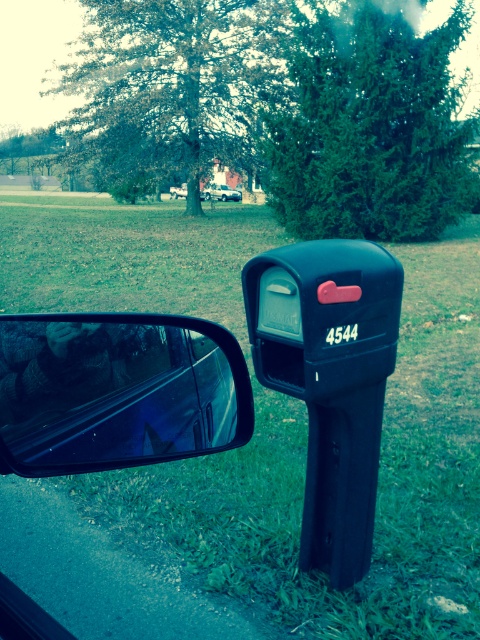
Question: Can you confirm if shiny black mirror at lower left is smaller than satin silver sedan at center?

Choices:
 (A) yes
 (B) no

Answer: (A)

Question: Which point is closer to the camera taking this photo?

Choices:
 (A) click(x=225, y=196)
 (B) click(x=273, y=269)
 (C) click(x=220, y=445)

Answer: (C)

Question: Which of the following is the farthest from the observer?

Choices:
 (A) (169, 356)
 (B) (178, 193)

Answer: (B)

Question: Can you confirm if green grass at lower center is wider than matte black mailbox at right?

Choices:
 (A) yes
 (B) no

Answer: (A)

Question: Which object is farther from the camera taking this photo?

Choices:
 (A) shiny black mirror at lower left
 (B) green grass at lower center
 (C) matte black mailbox at right
 (D) satin silver sedan at center

Answer: (D)

Question: Can you confirm if matte black mailbox at right is thinner than satin silver sedan at center?

Choices:
 (A) no
 (B) yes

Answer: (B)